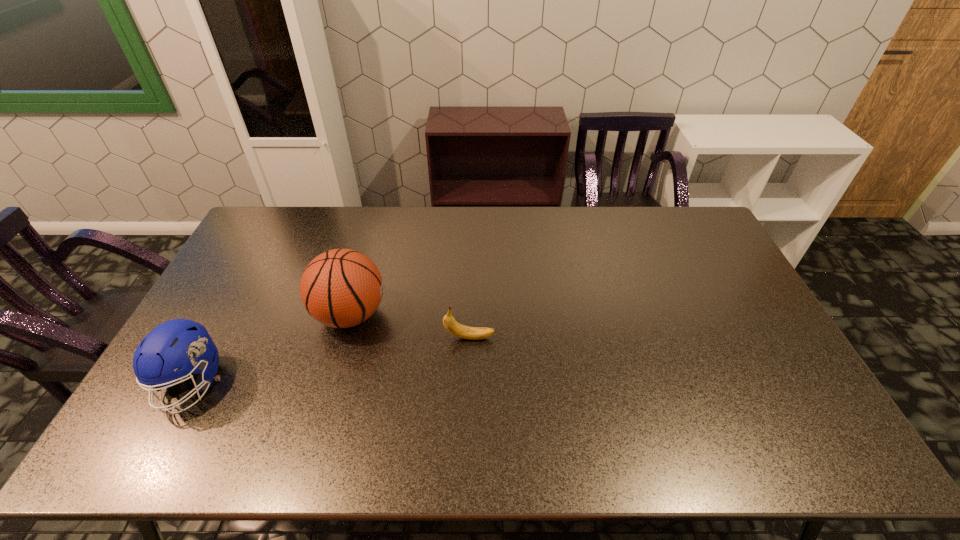
Where is `the second object from right to left`? This screenshot has width=960, height=540. the second object from right to left is located at coordinates (340, 288).

You are a GUI agent. You are given a task and a screenshot of the screen. Output one action in this format:
    pyautogui.click(x=<x>, y=<y>)
    Task: Click on the basketball
    This screenshot has width=960, height=540.
    Given the screenshot: What is the action you would take?
    pyautogui.click(x=340, y=288)

Locate an element on the screen. Image resolution: width=960 pixels, height=540 pixels. the second shortest object is located at coordinates (182, 344).

Image resolution: width=960 pixels, height=540 pixels. I want to click on the nearest object, so click(182, 344).

The width and height of the screenshot is (960, 540). Find the location of `the shortest object`. the shortest object is located at coordinates (452, 326).

Where is `banana`? The image size is (960, 540). banana is located at coordinates (452, 326).

At what (x,y) coordinates should I click in order to perform the action: click on free region located on the side where the inflation valve is located. Please return your answer as a coordinate pair (x, y). The width and height of the screenshot is (960, 540). Looking at the image, I should click on (437, 315).

I want to click on vacant space situated on the front-facing side of the second tallest object, so click(153, 453).

At what (x,y) coordinates should I click in order to perform the action: click on vacant space located at the start of the peel on the banana. Please return your answer as a coordinate pair (x, y). The height and width of the screenshot is (540, 960). Looking at the image, I should click on (516, 338).

Find the location of a particular element. object that is at the left edge is located at coordinates (182, 344).